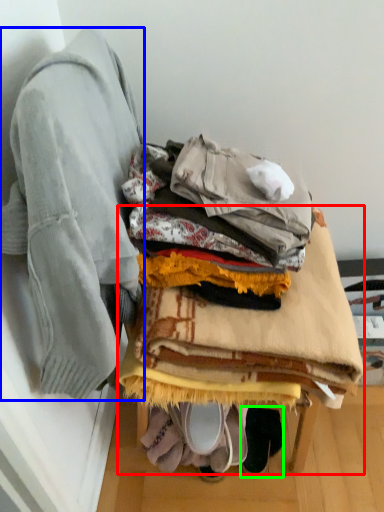
Question: Which object is the farthest from furniture (highlighted by a red box)? Choose among these: jacket (highlighted by a blue box) or footwear (highlighted by a green box).

Choices:
 (A) jacket
 (B) footwear

Answer: (B)